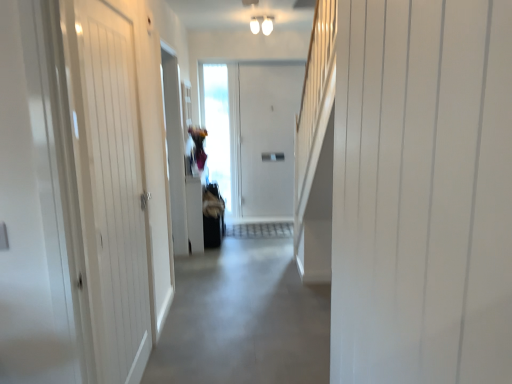
This screenshot has height=384, width=512. What do you see at coordinates (244, 315) in the screenshot?
I see `gray concrete floor at center` at bounding box center [244, 315].

The width and height of the screenshot is (512, 384). Describe the element at coordinates (111, 188) in the screenshot. I see `white wooden door at left, the first door when ordered from back to front` at that location.

Locate an element on the screen. The width and height of the screenshot is (512, 384). white smooth door at right, which is the 2th door in back-to-front order is located at coordinates (422, 192).

Does point (210, 333) appear closer or farther from the camera than point (118, 52)?

Point (210, 333) appears to be farther away from the viewer than point (118, 52).

From a real-world perspective, which is physically above, gray concrete floor at center or white wooden door at left, which appears as the second door when viewed from the front?

white wooden door at left, which appears as the second door when viewed from the front.

From the image's perspective, does gray concrete floor at center appear lower than white wooden door at left, the 1th door in the left-to-right sequence?

Yes.

Does gray concrete floor at center appear on the right side of white wooden door at left, the first door when ordered from back to front?

Yes, gray concrete floor at center is to the right of white wooden door at left, the first door when ordered from back to front.

Is point (239, 379) in front of point (420, 153)?

That is False.

Is gray concrete floor at center not near white smooth door at right, which appears as the 1th door when viewed from the right?

That's right, there is a large distance between gray concrete floor at center and white smooth door at right, which appears as the 1th door when viewed from the right.

Would you say gray concrete floor at center is to the left or to the right of white smooth door at right, which is the 2th door in back-to-front order, in the picture?

In the image, gray concrete floor at center appears on the left side of white smooth door at right, which is the 2th door in back-to-front order.

Considering the sizes of objects gray concrete floor at center and white smooth door at right, marked as the first door in a front-to-back arrangement, in the image provided, who is thinner, gray concrete floor at center or white smooth door at right, marked as the first door in a front-to-back arrangement,?

white smooth door at right, marked as the first door in a front-to-back arrangement.

Are white wooden door at left, the second door from the right, and gray concrete floor at center beside each other?

No, white wooden door at left, the second door from the right, is not touching gray concrete floor at center.

Based on the photo, considering the positions of objects white wooden door at left, the second door from the right, and gray concrete floor at center in the image provided, who is behind, white wooden door at left, the second door from the right, or gray concrete floor at center?

gray concrete floor at center is further away from the camera.

Considering the sizes of white wooden door at left, the first door when ordered from back to front, and gray concrete floor at center in the image, is white wooden door at left, the first door when ordered from back to front, taller or shorter than gray concrete floor at center?

In the image, white wooden door at left, the first door when ordered from back to front, appears to be taller than gray concrete floor at center.

From the image's perspective, which one is positioned lower, white wooden door at left, which appears as the second door when viewed from the front, or gray concrete floor at center?

gray concrete floor at center.

How different are the orientations of white wooden door at left, the second door from the right, and white smooth door at right, the 2th door positioned from the left, in degrees?

The facing directions of white wooden door at left, the second door from the right, and white smooth door at right, the 2th door positioned from the left, are 170 degrees apart.

Looking at this image, between white wooden door at left, which appears as the second door when viewed from the front, and white smooth door at right, the 2th door positioned from the left, which one has smaller size?

white wooden door at left, which appears as the second door when viewed from the front.

From the picture: Is white wooden door at left, the first door when ordered from back to front, looking in the opposite direction of white smooth door at right, which is the 2th door in back-to-front order?

white wooden door at left, the first door when ordered from back to front, does not have its back to white smooth door at right, which is the 2th door in back-to-front order.

Considering the positions of objects white wooden door at left, which appears as the second door when viewed from the front, and white smooth door at right, the 2th door positioned from the left, in the image provided, who is more to the right, white wooden door at left, which appears as the second door when viewed from the front, or white smooth door at right, the 2th door positioned from the left,?

From the viewer's perspective, white smooth door at right, the 2th door positioned from the left, appears more on the right side.

Which object is thinner, white smooth door at right, which appears as the 1th door when viewed from the right, or gray concrete floor at center?

white smooth door at right, which appears as the 1th door when viewed from the right.

Would you say white smooth door at right, the 2th door positioned from the left, is outside gray concrete floor at center?

white smooth door at right, the 2th door positioned from the left, lies outside gray concrete floor at center's area.

From the image's perspective, which is below, white smooth door at right, which appears as the 1th door when viewed from the right, or gray concrete floor at center?

gray concrete floor at center, from the image's perspective.

Is white wooden door at left, the first door when ordered from back to front, located within white smooth door at right, the 2th door positioned from the left?

No, white smooth door at right, the 2th door positioned from the left, does not contain white wooden door at left, the first door when ordered from back to front.

Does white smooth door at right, marked as the first door in a front-to-back arrangement, have a lesser width compared to white wooden door at left, the 1th door in the left-to-right sequence?

No.

Is white smooth door at right, which appears as the 1th door when viewed from the right, turned away from white wooden door at left, the second door from the right?

white smooth door at right, which appears as the 1th door when viewed from the right, does not have its back to white wooden door at left, the second door from the right.

Is white smooth door at right, the 2th door positioned from the left, far away from white wooden door at left, which appears as the second door when viewed from the front?

white smooth door at right, the 2th door positioned from the left, is positioned a significant distance from white wooden door at left, which appears as the second door when viewed from the front.

The width and height of the screenshot is (512, 384). I want to click on alley below the white wooden door at left, the first door when ordered from back to front (from the image's perspective), so click(244, 315).

Locate an element on the screen. The image size is (512, 384). alley beneath the white smooth door at right, marked as the first door in a front-to-back arrangement (from a real-world perspective) is located at coordinates (244, 315).

From the image, which object appears to be nearer to white smooth door at right, which appears as the 1th door when viewed from the right, gray concrete floor at center or white wooden door at left, the 1th door in the left-to-right sequence?

The object closer to white smooth door at right, which appears as the 1th door when viewed from the right, is white wooden door at left, the 1th door in the left-to-right sequence.

Looking at the image, which one is located closer to gray concrete floor at center, white smooth door at right, the 2th door positioned from the left, or white wooden door at left, the first door when ordered from back to front?

white wooden door at left, the first door when ordered from back to front, is positioned closer to the anchor gray concrete floor at center.

Looking at the image, which one is located further to white smooth door at right, which appears as the 1th door when viewed from the right, white wooden door at left, the first door when ordered from back to front, or gray concrete floor at center?

gray concrete floor at center is positioned further to the anchor white smooth door at right, which appears as the 1th door when viewed from the right.

Which object lies further to the anchor point white wooden door at left, the second door from the right, white smooth door at right, which is the 2th door in back-to-front order, or gray concrete floor at center?

white smooth door at right, which is the 2th door in back-to-front order, lies further to white wooden door at left, the second door from the right, than the other object.

Looking at this image, when comparing their distances from gray concrete floor at center, does white wooden door at left, the first door when ordered from back to front, or white smooth door at right, which appears as the 1th door when viewed from the right, seem closer?

white wooden door at left, the first door when ordered from back to front, is closer to gray concrete floor at center.

When comparing their distances from white wooden door at left, which appears as the second door when viewed from the front, does gray concrete floor at center or white smooth door at right, which is the 2th door in back-to-front order, seem further?

white smooth door at right, which is the 2th door in back-to-front order.

This screenshot has height=384, width=512. Identify the location of door located between white smooth door at right, which is the 2th door in back-to-front order, and gray concrete floor at center in the depth direction. (111, 188).